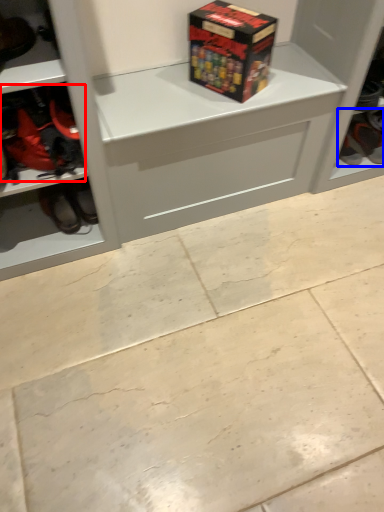
Question: Which of the following is the closest to the observer, footwear (highlighted by a red box) or footwear (highlighted by a blue box)?

Choices:
 (A) footwear
 (B) footwear

Answer: (A)